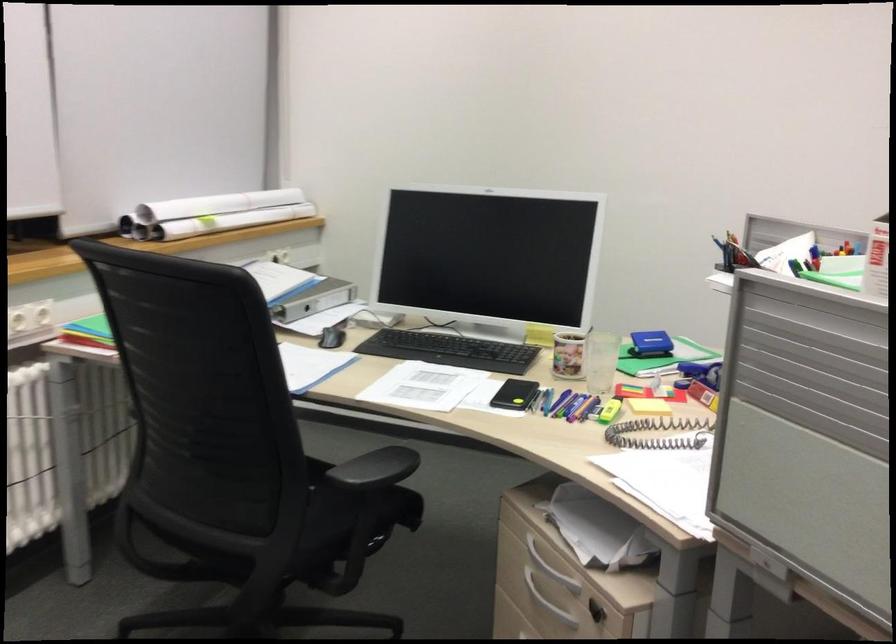
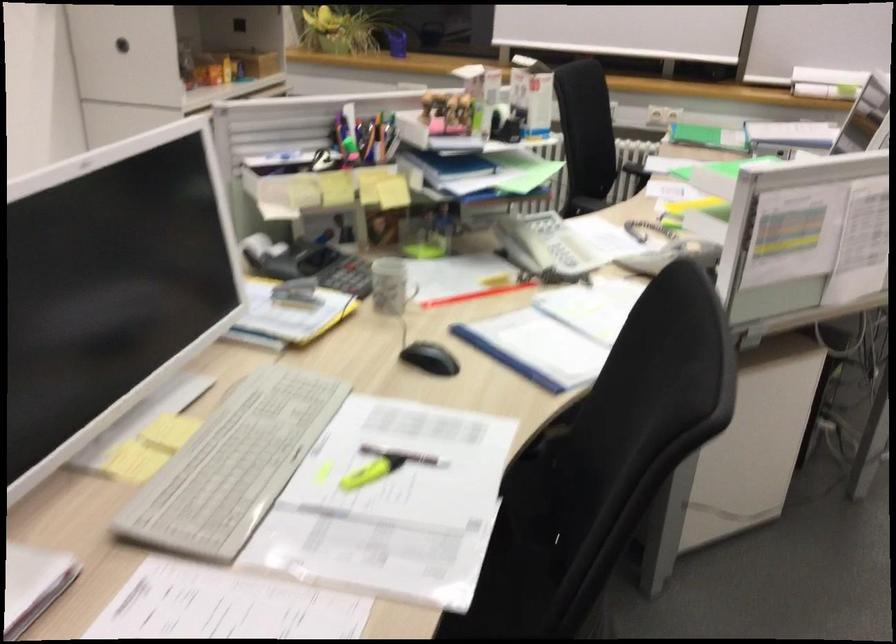
Question: I am providing you with two images of the same scene from different viewpoints. After the viewpoint changes to image2, which objects are now occluded?

Choices:
 (A) purple pen
 (B) black chair armrest
 (C) yellow highlighter pen
 (D) grey figurine

Answer: (A)